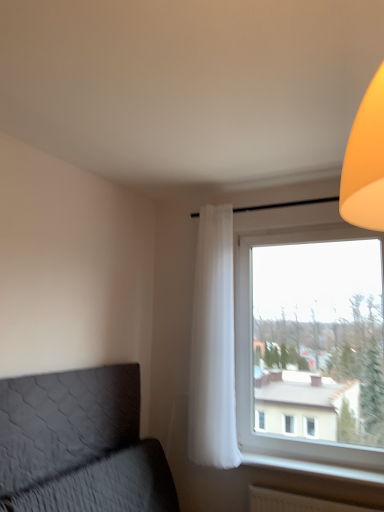
Question: Is white sheer curtain at center completely or partially outside of dark gray quilted headboard at lower left?

Choices:
 (A) yes
 (B) no

Answer: (A)

Question: Is white sheer curtain at center shorter than dark gray quilted headboard at lower left?

Choices:
 (A) yes
 (B) no

Answer: (B)

Question: Is white sheer curtain at center next to dark gray quilted headboard at lower left and touching it?

Choices:
 (A) yes
 (B) no

Answer: (B)

Question: Is dark gray quilted headboard at lower left located within white sheer curtain at center?

Choices:
 (A) no
 (B) yes

Answer: (A)

Question: Could you tell me if white sheer curtain at center is facing dark gray quilted headboard at lower left?

Choices:
 (A) no
 (B) yes

Answer: (A)

Question: Is white sheer curtain at center in front of dark gray quilted headboard at lower left?

Choices:
 (A) yes
 (B) no

Answer: (B)

Question: From the image's perspective, would you say white plastic radiator at lower right is shown under transparent glass window at right?

Choices:
 (A) no
 (B) yes

Answer: (B)

Question: From the image's perspective, would you say white plastic radiator at lower right is positioned over transparent glass window at right?

Choices:
 (A) yes
 (B) no

Answer: (B)

Question: Are white plastic radiator at lower right and transparent glass window at right located far from each other?

Choices:
 (A) no
 (B) yes

Answer: (A)

Question: Is white plastic radiator at lower right positioned in front of transparent glass window at right?

Choices:
 (A) yes
 (B) no

Answer: (A)

Question: Can you confirm if white plastic radiator at lower right is thinner than transparent glass window at right?

Choices:
 (A) no
 (B) yes

Answer: (A)

Question: Is white plastic radiator at lower right turned away from transparent glass window at right?

Choices:
 (A) no
 (B) yes

Answer: (A)

Question: Can you see white plastic radiator at lower right touching dark gray quilted headboard at lower left?

Choices:
 (A) no
 (B) yes

Answer: (A)